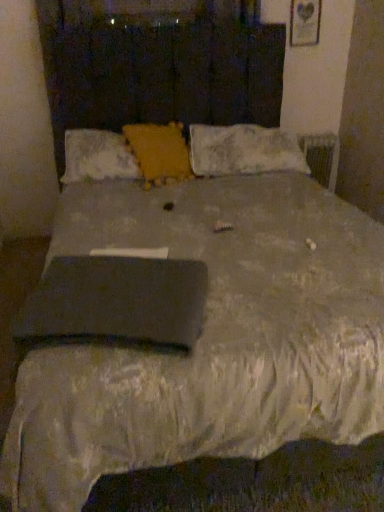
Question: Considering the relative sizes of black matte pad at center and white fluffy pillow at upper right, acting as the 1th pillow starting from the right, in the image provided, is black matte pad at center taller than white fluffy pillow at upper right, acting as the 1th pillow starting from the right,?

Choices:
 (A) yes
 (B) no

Answer: (B)

Question: Is black matte pad at center shorter than white fluffy pillow at upper right, acting as the 1th pillow starting from the right?

Choices:
 (A) no
 (B) yes

Answer: (B)

Question: From the image's perspective, would you say black matte pad at center is shown under white fluffy pillow at upper right, acting as the 1th pillow starting from the right?

Choices:
 (A) yes
 (B) no

Answer: (A)

Question: Is there a large distance between black matte pad at center and white fluffy pillow at upper right, acting as the 1th pillow starting from the right?

Choices:
 (A) yes
 (B) no

Answer: (A)

Question: Is black matte pad at center positioned before white fluffy pillow at upper right, arranged as the third pillow when viewed from the left?

Choices:
 (A) no
 (B) yes

Answer: (B)

Question: Can you confirm if black matte pad at center is wider than white fluffy pillow at upper right, acting as the 1th pillow starting from the right?

Choices:
 (A) no
 (B) yes

Answer: (A)

Question: Considering the relative sizes of black matte pad at center and yellow textured pillow at center, which appears as the second pillow when viewed from the right, in the image provided, is black matte pad at center taller than yellow textured pillow at center, which appears as the second pillow when viewed from the right,?

Choices:
 (A) no
 (B) yes

Answer: (A)

Question: From the image's perspective, is black matte pad at center beneath yellow textured pillow at center, which appears as the second pillow when viewed from the right?

Choices:
 (A) yes
 (B) no

Answer: (A)

Question: Is black matte pad at center oriented towards yellow textured pillow at center, which is the second pillow from left to right?

Choices:
 (A) yes
 (B) no

Answer: (B)

Question: Does black matte pad at center have a smaller size compared to yellow textured pillow at center, which is the second pillow from left to right?

Choices:
 (A) no
 (B) yes

Answer: (B)

Question: Is black matte pad at center positioned with its back to yellow textured pillow at center, which appears as the second pillow when viewed from the right?

Choices:
 (A) yes
 (B) no

Answer: (A)

Question: Is yellow textured pillow at center, which appears as the second pillow when viewed from the right, located within black matte pad at center?

Choices:
 (A) yes
 (B) no

Answer: (B)

Question: Is yellow textured pillow at center, which appears as the second pillow when viewed from the right, surrounded by white fluffy pillow at upper right, acting as the 1th pillow starting from the right?

Choices:
 (A) no
 (B) yes

Answer: (A)